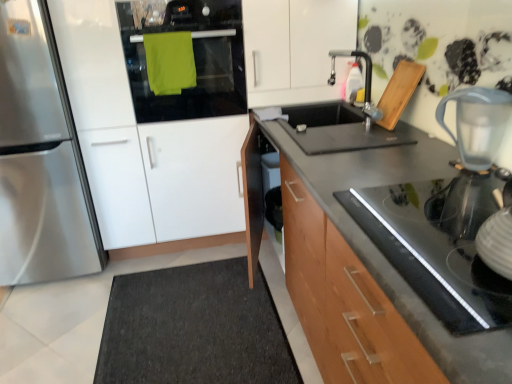
Locate an element on the screen. Image resolution: width=512 pixels, height=384 pixels. free space to the right of satin silver refrigerator at left is located at coordinates (117, 281).